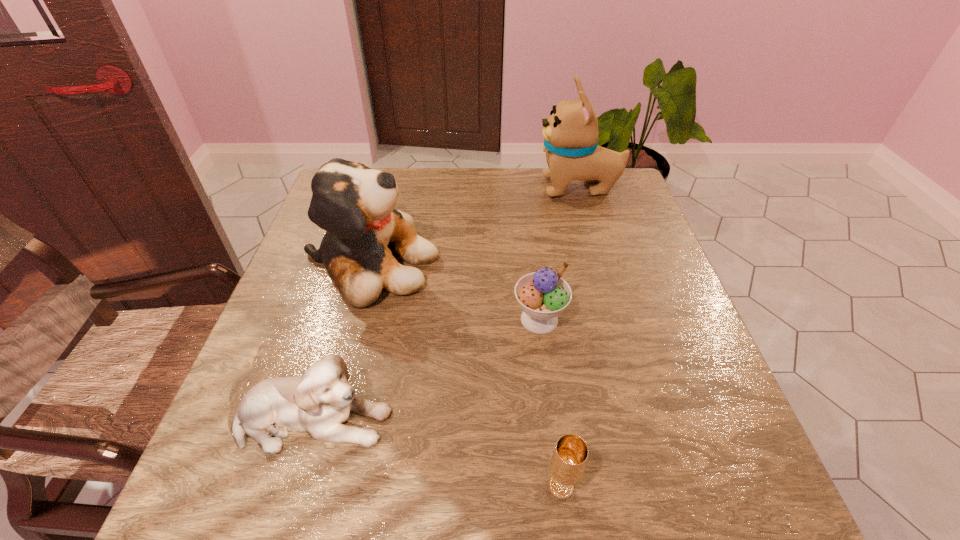
This screenshot has width=960, height=540. I want to click on the farthest object, so click(570, 134).

The width and height of the screenshot is (960, 540). Find the location of `the rightmost puppy`. the rightmost puppy is located at coordinates (570, 134).

Find the location of a particular element. This screenshot has height=540, width=960. the second farthest puppy is located at coordinates (355, 205).

At what (x,y) coordinates should I click in order to perform the action: click on icecream. Please return your answer as a coordinate pair (x, y). This screenshot has width=960, height=540. Looking at the image, I should click on (543, 295).

Locate an element on the screen. the shortest puppy is located at coordinates (319, 402).

You are a GUI agent. You are given a task and a screenshot of the screen. Output one action in this format:
    pyautogui.click(x=<x>, y=<y>)
    Task: Click on the second nearest object
    This screenshot has width=960, height=540.
    Given the screenshot: What is the action you would take?
    pyautogui.click(x=319, y=402)

Where is `chalice`? The width and height of the screenshot is (960, 540). chalice is located at coordinates (569, 458).

Find the location of `vacant space situated on the face of the farthest puppy`. vacant space situated on the face of the farthest puppy is located at coordinates (507, 187).

This screenshot has height=540, width=960. What are the coordinates of `vacant area located on the face of the farthest puppy` in the screenshot? It's located at (496, 187).

This screenshot has height=540, width=960. What are the coordinates of `free space located 0.340m on the face of the farthest puppy` in the screenshot? It's located at (424, 187).